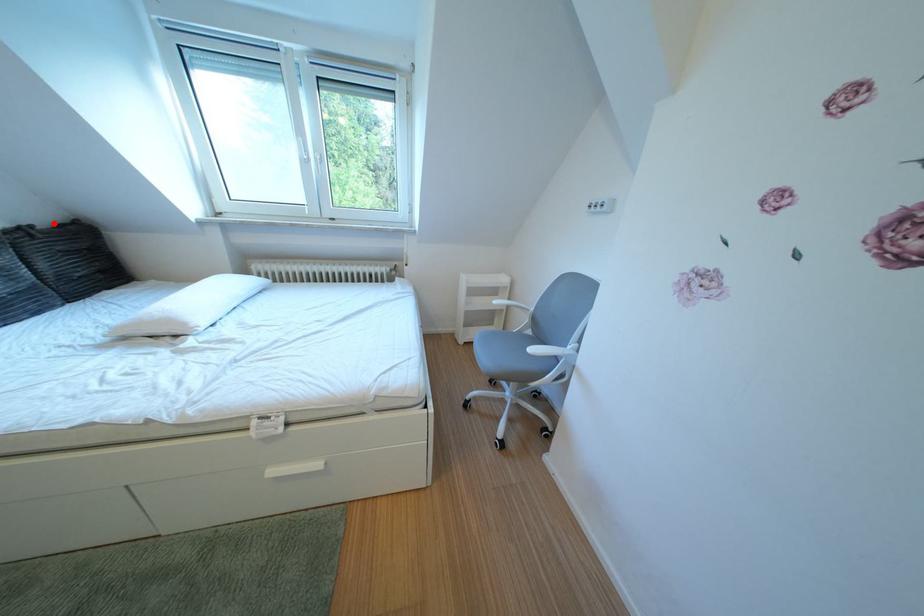
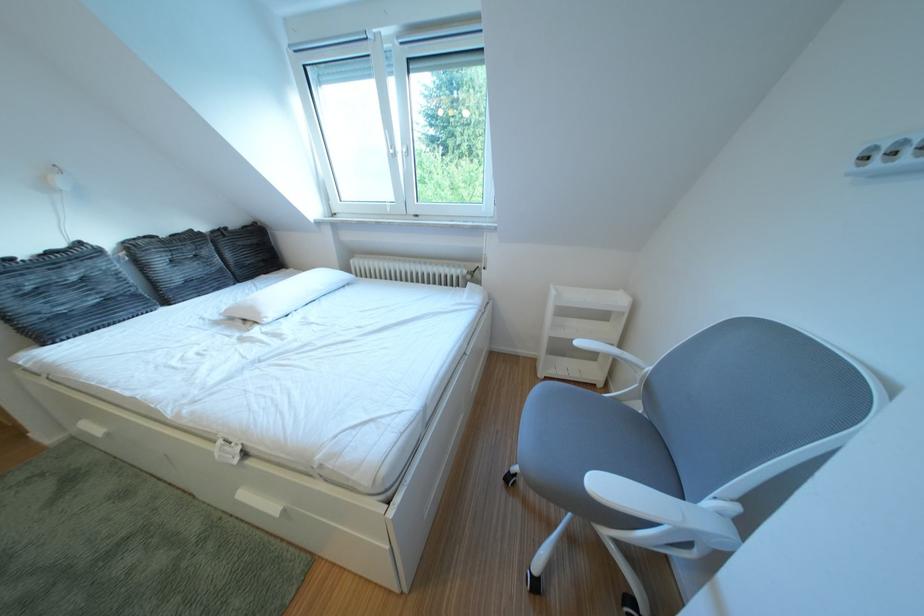
In the second image, find the point that corresponds to the highlighted location in the first image.

(247, 228)